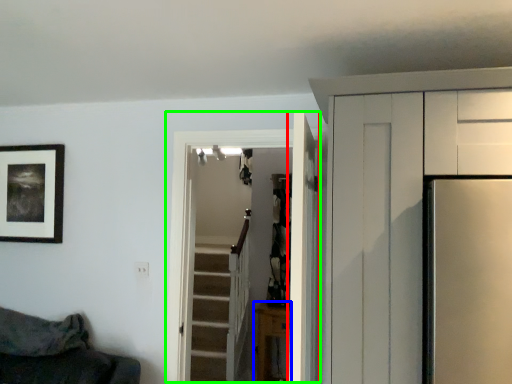
Question: Estimate the real-world distances between objects in this image. Which object is closer to door (highlighted by a red box), furniture (highlighted by a blue box) or door (highlighted by a green box)?

Choices:
 (A) furniture
 (B) door

Answer: (B)